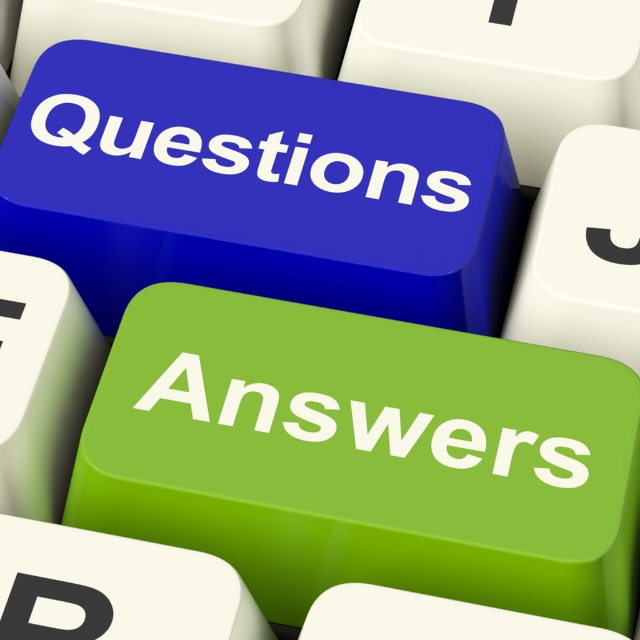
Does blue plastic questions at upper center have a larger size compared to green matte/soft answers at center?

Correct, blue plastic questions at upper center is larger in size than green matte/soft answers at center.

Between blue plastic questions at upper center and green matte/soft answers at center, which one appears on the right side from the viewer's perspective?

green matte/soft answers at center

The height and width of the screenshot is (640, 640). Describe the element at coordinates (240, 154) in the screenshot. I see `blue plastic questions at upper center` at that location.

Find the location of `blue plastic questions at upper center`. blue plastic questions at upper center is located at coordinates (240, 154).